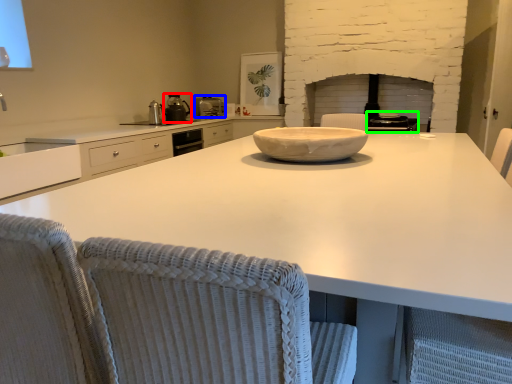
Question: Which object is positioned farthest from appliance (highlighted by a red box)? Select from kitchen appliance (highlighted by a blue box) and appliance (highlighted by a green box).

Choices:
 (A) kitchen appliance
 (B) appliance

Answer: (B)